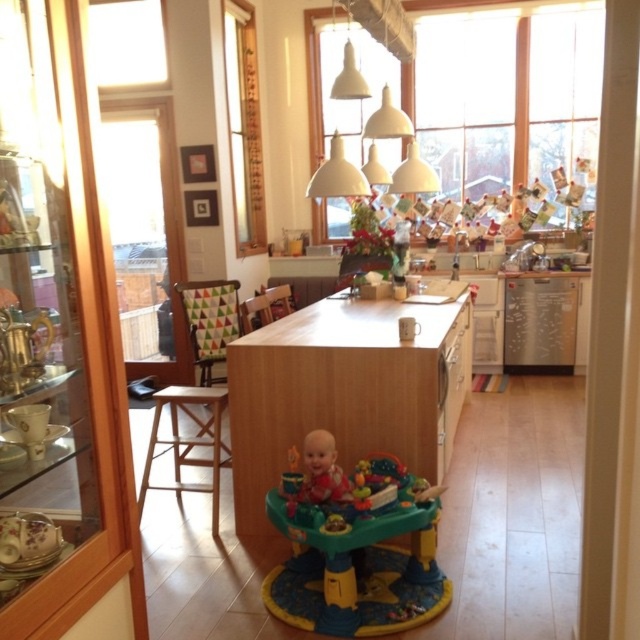
Is multicolored plastic walker at center shorter than wooden stool at left?

No.

From the picture: Is multicolored plastic walker at center wider than wooden stool at left?

Correct, the width of multicolored plastic walker at center exceeds that of wooden stool at left.

Is point (310, 582) farther from camera compared to point (186, 486)?

No, (310, 582) is in front of (186, 486).

Where is `multicolored plastic walker at center`? This screenshot has width=640, height=640. multicolored plastic walker at center is located at coordinates (355, 547).

Can you confirm if multicolored plastic walker at center is positioned below matte red baby walker at center?

Yes, multicolored plastic walker at center is below matte red baby walker at center.

Is point (426, 518) positioned behind point (307, 438)?

No, (426, 518) is in front of (307, 438).

Which is in front, point (372, 604) or point (344, 499)?

Positioned in front is point (372, 604).

I want to click on multicolored plastic walker at center, so click(x=355, y=547).

Which is in front, point (330, 440) or point (253, 307)?

Point (330, 440) is in front.

Which is below, matte red baby walker at center or wooden textured chair at center?

matte red baby walker at center

I want to click on matte red baby walker at center, so (323, 468).